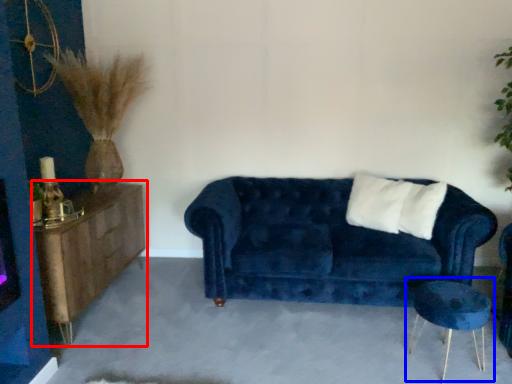
Question: Which point is closer to the camera, dresser (highlighted by a red box) or side table (highlighted by a blue box)?

Choices:
 (A) dresser
 (B) side table

Answer: (B)